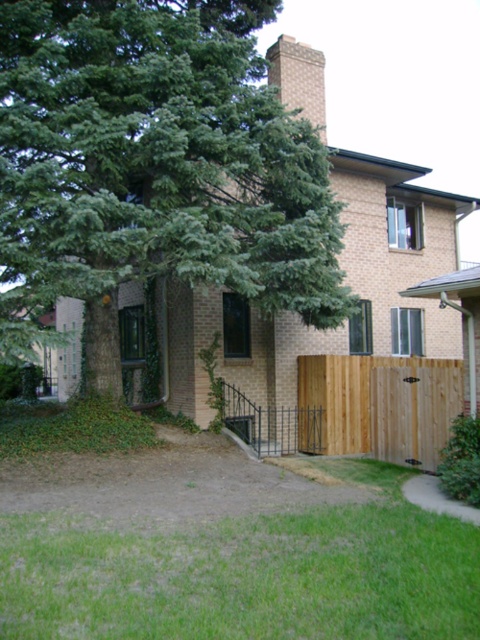
Question: Estimate the real-world distances between objects in this image. Which object is farther from the brown wooden fence at lower right?

Choices:
 (A) brick chimney at upper center
 (B) green leafy tree at upper left

Answer: (B)

Question: Which point appears closest to the camera in this image?

Choices:
 (A) (396, 371)
 (B) (274, 51)
 (C) (137, 131)

Answer: (C)

Question: Which point is closer to the camera taking this photo?

Choices:
 (A) (280, 35)
 (B) (72, 186)

Answer: (B)

Question: Is green leafy tree at upper left further to the viewer compared to brown wooden fence at lower right?

Choices:
 (A) yes
 (B) no

Answer: (B)

Question: Considering the relative positions of brown wooden fence at lower right and brick chimney at upper center in the image provided, where is brown wooden fence at lower right located with respect to brick chimney at upper center?

Choices:
 (A) above
 (B) below

Answer: (B)

Question: Can you confirm if brown wooden fence at lower right is positioned above brick chimney at upper center?

Choices:
 (A) yes
 (B) no

Answer: (B)